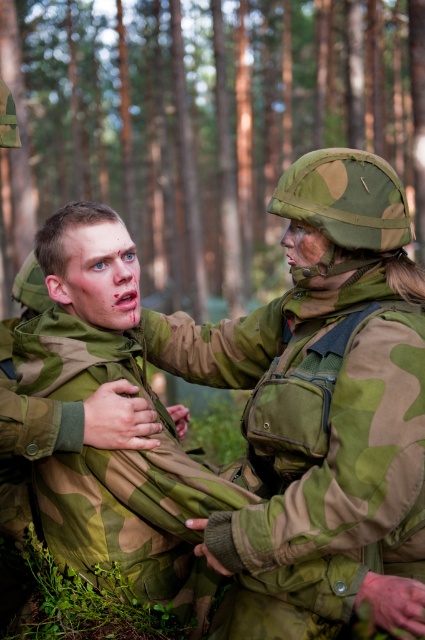
Does green camouflage pine forest at upper center have a greater width compared to camo uniform at center?

Yes, green camouflage pine forest at upper center is wider than camo uniform at center.

Can you confirm if green camouflage pine forest at upper center is positioned to the left of camo uniform at center?

Yes, green camouflage pine forest at upper center is to the left of camo uniform at center.

Where is `green camouflage pine forest at upper center`? green camouflage pine forest at upper center is located at coordinates (203, 125).

Measure the distance between point (362, 157) and camera.

Point (362, 157) and camera are 5.56 feet apart.

Locate an element on the screen. This screenshot has height=640, width=425. camouflage fabric uniform at center is located at coordinates (319, 406).

Between point (394, 394) and point (67, 268), which one is positioned in front?

Point (394, 394) is more forward.

The width and height of the screenshot is (425, 640). I want to click on camouflage fabric uniform at center, so click(x=319, y=406).

Can you confirm if green camouflage pine forest at upper center is bigger than camouflage fabric uniform at center?

Correct, green camouflage pine forest at upper center is larger in size than camouflage fabric uniform at center.

Between point (269, 88) and point (274, 380), which one is positioned behind?

Point (269, 88)

At what (x,y) coordinates should I click in order to perform the action: click on green camouflage pine forest at upper center. Please return your answer as a coordinate pair (x, y). Looking at the image, I should click on (203, 125).